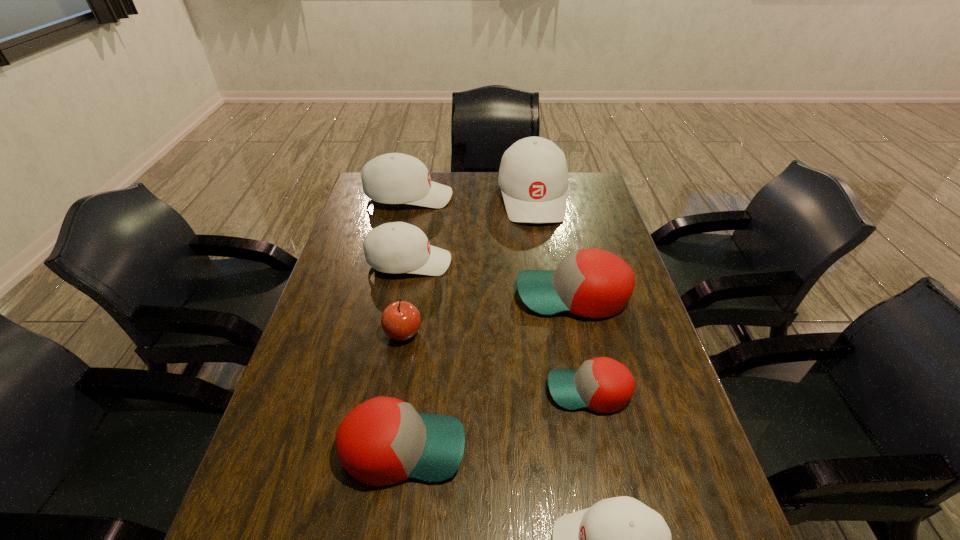
Where is `the biggest white baseball cap`? This screenshot has width=960, height=540. the biggest white baseball cap is located at coordinates (533, 176).

The width and height of the screenshot is (960, 540). Identify the location of the tallest object. (533, 176).

Where is `the second tallest baseball cap`? This screenshot has height=540, width=960. the second tallest baseball cap is located at coordinates (394, 178).

Image resolution: width=960 pixels, height=540 pixels. I want to click on the second biggest white baseball cap, so click(x=394, y=178).

I want to click on the biggest red baseball cap, so click(594, 283).

The width and height of the screenshot is (960, 540). What are the coordinates of `the third biggest white baseball cap` in the screenshot? It's located at (397, 247).

Image resolution: width=960 pixels, height=540 pixels. Find the location of `apple`. apple is located at coordinates (401, 320).

Where is `the leftmost red baseball cap`? This screenshot has width=960, height=540. the leftmost red baseball cap is located at coordinates (384, 440).

In order to click on the shortest baseball cap in this screenshot , I will do `click(602, 384)`.

Locate an element on the screen. the shortest object is located at coordinates (602, 384).